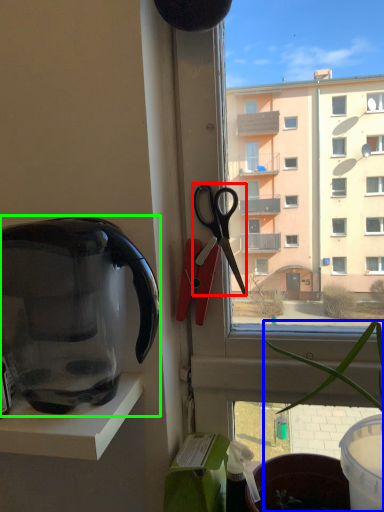
Question: Which is farther away from scissors (highlighted by a red box)? houseplant (highlighted by a blue box) or kettle (highlighted by a green box)?

Choices:
 (A) houseplant
 (B) kettle

Answer: (B)